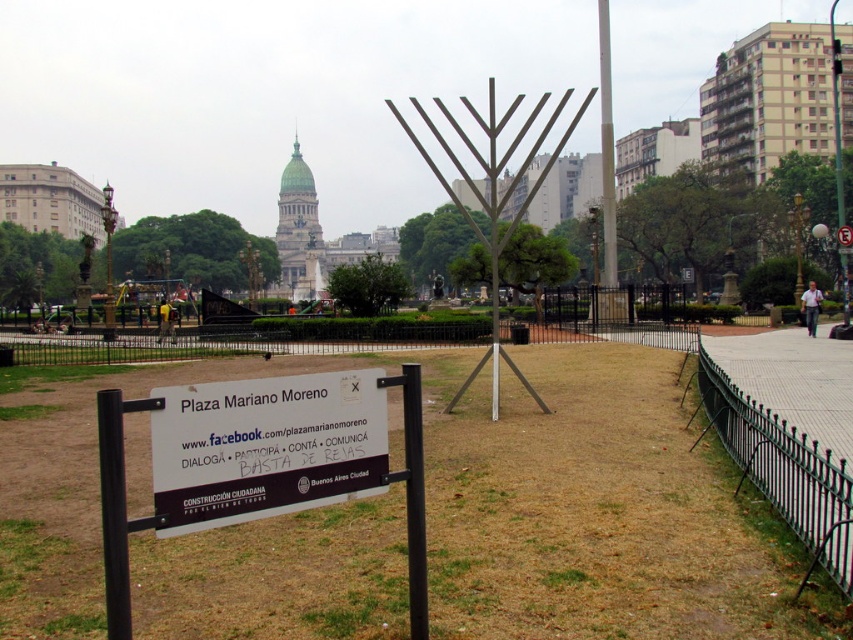
Question: Which of the following is the farthest from the observer?

Choices:
 (A) (846, 323)
 (B) (767, 429)

Answer: (A)

Question: Can you confirm if green grass at center is positioned to the right of white glossy pole at upper center?

Choices:
 (A) no
 (B) yes

Answer: (A)

Question: Is white plastic sign at center to the right of metallic silver menorah at center from the viewer's perspective?

Choices:
 (A) no
 (B) yes

Answer: (A)

Question: Which point appears closest to the camera in this image?

Choices:
 (A) (842, 188)
 (B) (73, 636)
 (C) (612, 204)
 (D) (840, 499)

Answer: (B)

Question: Considering the real-world distances, which object is closest to the black wrought iron fence at right?

Choices:
 (A) metallic silver menorah at center
 (B) green grass at center

Answer: (B)

Question: Is black wrought iron fence at right positioned behind brushed metal pole at upper right?

Choices:
 (A) no
 (B) yes

Answer: (A)